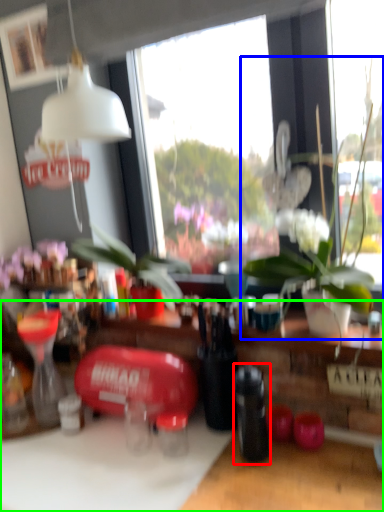
Question: Which is farther away from bottle (highlighted by a red box)? houseplant (highlighted by a blue box) or table (highlighted by a green box)?

Choices:
 (A) houseplant
 (B) table

Answer: (A)